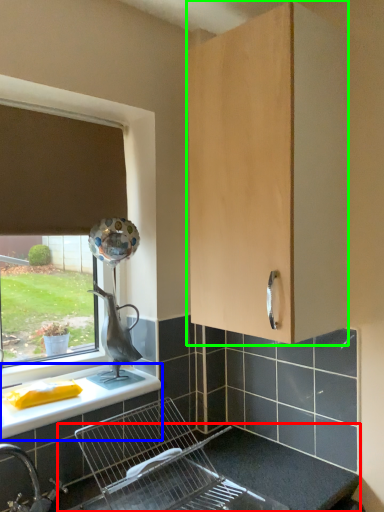
Question: Estimate the real-world distances between objects in this image. Which object is farther from counter top (highlighted by a red box), countertop (highlighted by a blue box) or cabinetry (highlighted by a green box)?

Choices:
 (A) countertop
 (B) cabinetry

Answer: (B)